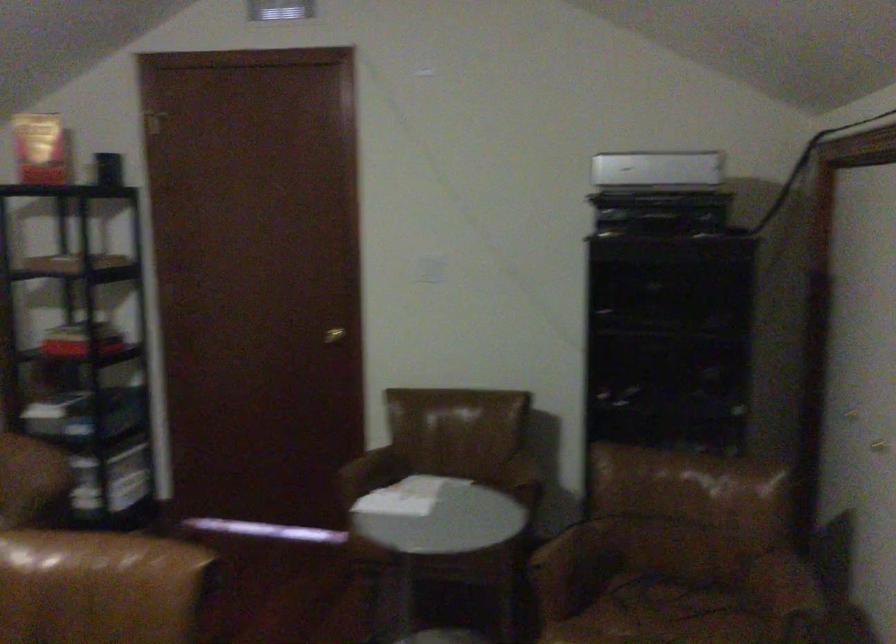
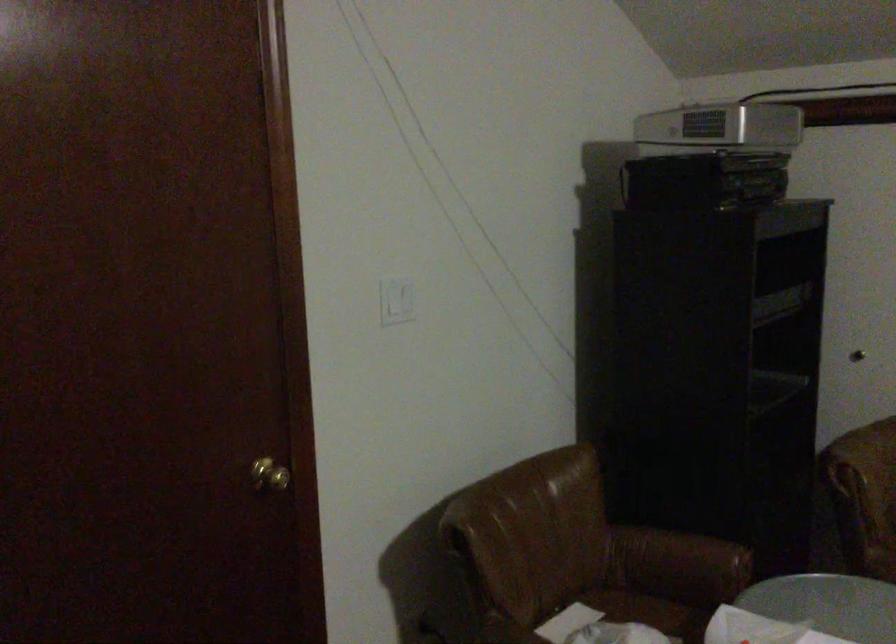
In the second image, find the point that corresponds to pixel 435 263 in the first image.

(397, 301)